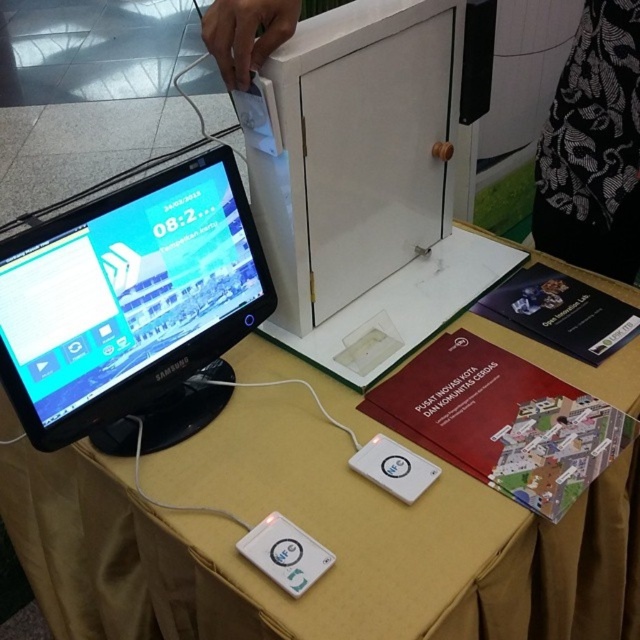
Question: Which is farther from the matte black monitor at left?

Choices:
 (A) yellow fabric table at center
 (B) white plastic nfc tag at lower center
 (C) white plastic ipod at lower center

Answer: (C)

Question: Is yellow fabric table at center bigger than white plastic nfc tag at lower center?

Choices:
 (A) no
 (B) yes

Answer: (B)

Question: Is black lace dress at upper right positioned behind white plastic nfc tag at lower center?

Choices:
 (A) yes
 (B) no

Answer: (A)

Question: Which object is positioned farthest from the matte black monitor at left?

Choices:
 (A) black lace dress at upper right
 (B) yellow fabric table at center

Answer: (A)

Question: Is yellow fabric table at center thinner than white plastic nfc tag at lower center?

Choices:
 (A) yes
 (B) no

Answer: (B)

Question: Based on their relative distances, which object is farther from the black lace dress at upper right?

Choices:
 (A) yellow fabric table at center
 (B) white plastic nfc tag at lower center
 (C) white plastic ipod at lower center

Answer: (B)